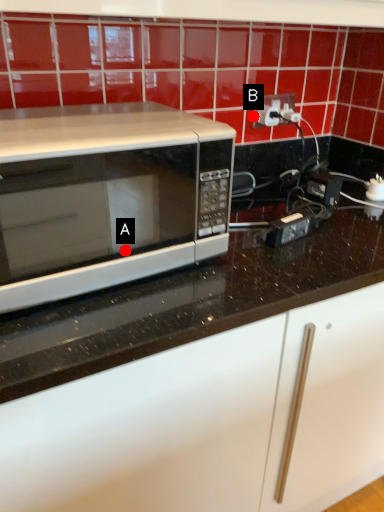
Question: Two points are circled on the image, labeled by A and B beside each circle. Which of the following is the farthest from the observer?

Choices:
 (A) A is further
 (B) B is further

Answer: (B)